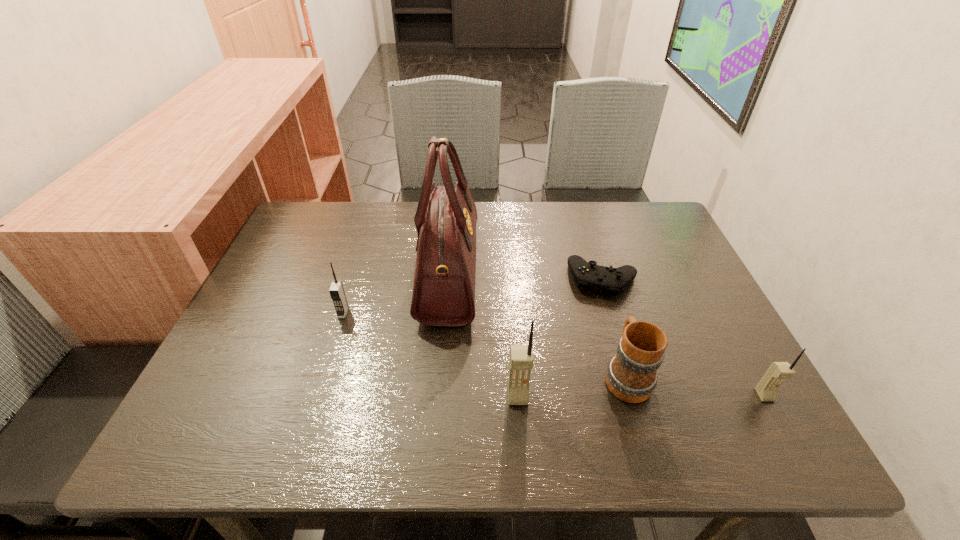
At what (x,y) coordinates should I click in order to perform the action: click on free space at the far edge of the desktop. Please return your answer as a coordinate pair (x, y). Looking at the image, I should click on (477, 250).

You are a GUI agent. You are given a task and a screenshot of the screen. Output one action in this format:
    pyautogui.click(x=<x>, y=<y>)
    Task: Click on the free space at the near edge of the desktop
    
    Given the screenshot: What is the action you would take?
    pyautogui.click(x=426, y=382)

Locate an element on the screen. The width and height of the screenshot is (960, 540). free space at the left edge is located at coordinates (322, 279).

This screenshot has width=960, height=540. Identify the location of vacant space at the right edge of the desktop. (640, 290).

Locate an element on the screen. The height and width of the screenshot is (540, 960). free spot at the far left corner of the desktop is located at coordinates (332, 249).

In the image, there is a desktop. At what (x,y) coordinates should I click in order to perform the action: click on free space at the far right corner. Please return your answer as a coordinate pair (x, y). The image size is (960, 540). Looking at the image, I should click on (657, 227).

Locate an element on the screen. Image resolution: width=960 pixels, height=540 pixels. vacant point located between the mug and the leftmost object is located at coordinates (485, 344).

The height and width of the screenshot is (540, 960). Find the location of `free point between the rightmost object and the control`. free point between the rightmost object and the control is located at coordinates [684, 338].

Locate an element on the screen. vacant space in between the leftmost cellular telephone and the mug is located at coordinates (485, 344).

The width and height of the screenshot is (960, 540). Find the location of `free spot between the rightmost cellular telephone and the shortest object`. free spot between the rightmost cellular telephone and the shortest object is located at coordinates (684, 338).